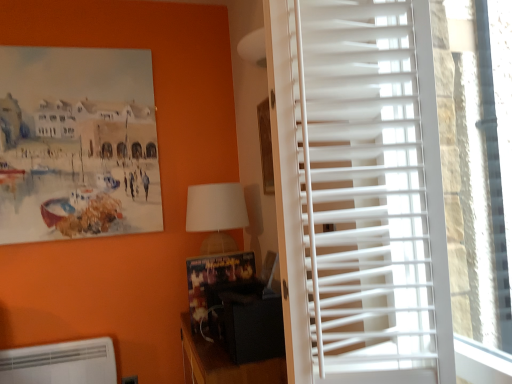
Question: Does black matte speaker at lower center have a lesser width compared to white plastic blinds at right?

Choices:
 (A) no
 (B) yes

Answer: (A)

Question: Is black matte speaker at lower center not close to white plastic blinds at right?

Choices:
 (A) yes
 (B) no

Answer: (B)

Question: From a real-world perspective, is black matte speaker at lower center over white plastic blinds at right?

Choices:
 (A) no
 (B) yes

Answer: (A)

Question: Is black matte speaker at lower center bigger than white plastic blinds at right?

Choices:
 (A) no
 (B) yes

Answer: (B)

Question: Does black matte speaker at lower center lie in front of white plastic blinds at right?

Choices:
 (A) no
 (B) yes

Answer: (A)

Question: Is white fabric lampshade at center taller or shorter than white plastic blinds at right?

Choices:
 (A) tall
 (B) short

Answer: (B)

Question: In terms of size, does white fabric lampshade at center appear bigger or smaller than white plastic blinds at right?

Choices:
 (A) big
 (B) small

Answer: (B)

Question: Is white fabric lampshade at center in front of or behind white plastic blinds at right in the image?

Choices:
 (A) behind
 (B) front

Answer: (A)

Question: Is white fabric lampshade at center inside the boundaries of white plastic blinds at right, or outside?

Choices:
 (A) outside
 (B) inside

Answer: (A)

Question: Is white fabric lampshade at center taller or shorter than white plastic blinds at right?

Choices:
 (A) tall
 (B) short

Answer: (B)

Question: Considering the positions of white fabric lampshade at center and white plastic blinds at right in the image, is white fabric lampshade at center wider or thinner than white plastic blinds at right?

Choices:
 (A) wide
 (B) thin

Answer: (A)

Question: Considering the positions of white fabric lampshade at center and white plastic blinds at right in the image, is white fabric lampshade at center bigger or smaller than white plastic blinds at right?

Choices:
 (A) big
 (B) small

Answer: (B)

Question: Is point (224, 196) closer or farther from the camera than point (468, 319)?

Choices:
 (A) farther
 (B) closer

Answer: (A)

Question: Would you say white plastic air conditioning unit at lower left is to the left or to the right of white plastic blinds at right in the picture?

Choices:
 (A) left
 (B) right

Answer: (A)

Question: Relative to white plastic blinds at right, is white plastic air conditioning unit at lower left in front or behind?

Choices:
 (A) front
 (B) behind

Answer: (B)